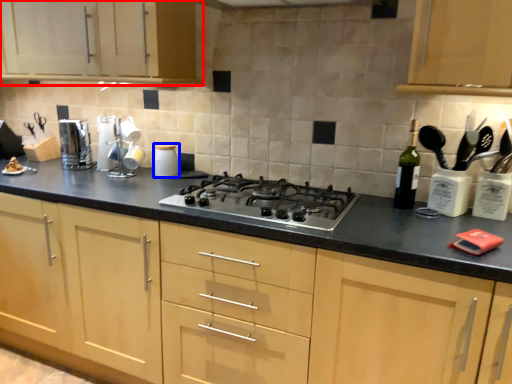
Question: Which object appears closest to the camera in this image, cabinetry (highlighted by a red box) or kitchen appliance (highlighted by a blue box)?

Choices:
 (A) cabinetry
 (B) kitchen appliance

Answer: (A)